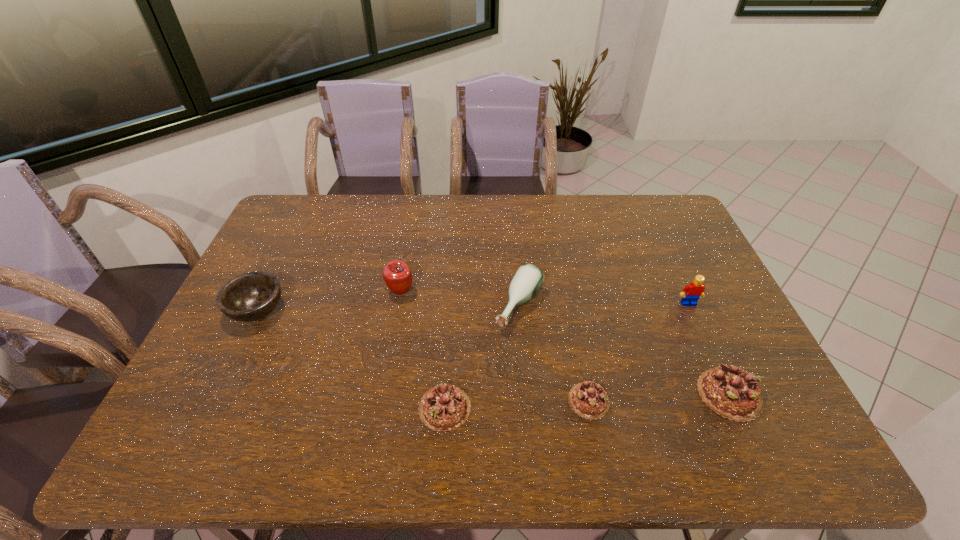
I want to click on free space for a new chocolate cake on the left, so click(298, 414).